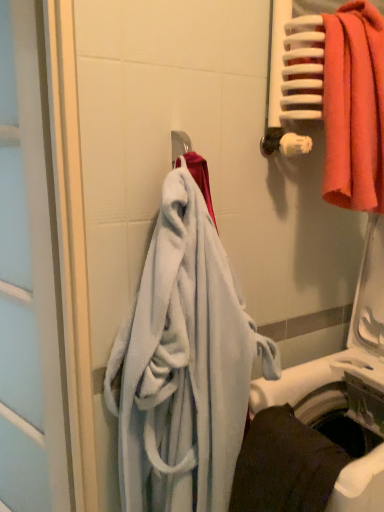
Question: Is white glossy screen door at left further to the viewer compared to dark gray fabric towel at lower right, the 3th towel positioned from the top?

Choices:
 (A) no
 (B) yes

Answer: (B)

Question: Is white glossy screen door at left aimed at dark gray fabric towel at lower right, which is counted as the first towel, starting from the bottom?

Choices:
 (A) yes
 (B) no

Answer: (B)

Question: From the image's perspective, does white glossy screen door at left appear lower than dark gray fabric towel at lower right, which is counted as the first towel, starting from the bottom?

Choices:
 (A) yes
 (B) no

Answer: (B)

Question: Is dark gray fabric towel at lower right, the 3th towel positioned from the top, surrounded by white glossy screen door at left?

Choices:
 (A) no
 (B) yes

Answer: (A)

Question: Does white glossy screen door at left have a greater height compared to dark gray fabric towel at lower right, which is counted as the first towel, starting from the bottom?

Choices:
 (A) yes
 (B) no

Answer: (A)

Question: Would you say white glossy screen door at left is outside dark gray fabric towel at lower right, the 3th towel positioned from the top?

Choices:
 (A) yes
 (B) no

Answer: (A)

Question: Is white plastic washing machine at lower right outside of white glossy screen door at left?

Choices:
 (A) no
 (B) yes

Answer: (B)

Question: Is white plastic washing machine at lower right with white glossy screen door at left?

Choices:
 (A) no
 (B) yes

Answer: (A)

Question: Is white plastic washing machine at lower right further to camera compared to white glossy screen door at left?

Choices:
 (A) yes
 (B) no

Answer: (B)

Question: Considering the relative sizes of white plastic washing machine at lower right and white glossy screen door at left in the image provided, is white plastic washing machine at lower right shorter than white glossy screen door at left?

Choices:
 (A) yes
 (B) no

Answer: (A)

Question: Is white plastic washing machine at lower right looking in the opposite direction of white glossy screen door at left?

Choices:
 (A) yes
 (B) no

Answer: (B)

Question: Considering the relative positions of white plastic washing machine at lower right and white glossy screen door at left in the image provided, is white plastic washing machine at lower right to the right of white glossy screen door at left from the viewer's perspective?

Choices:
 (A) no
 (B) yes

Answer: (B)

Question: Is matte orange towel at upper right, marked as the first towel in a top-to-bottom arrangement, outside of dark gray fabric towel at lower right, the 3th towel positioned from the top?

Choices:
 (A) no
 (B) yes

Answer: (B)